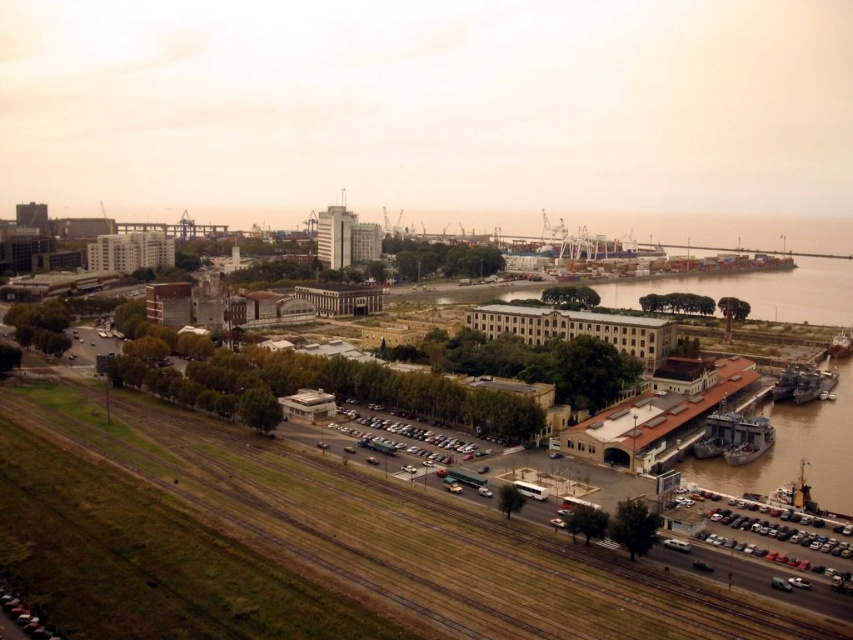
You are a drone operator tasked with capturing aerial footage of the urban waterfront area. You need to ensure that both the brown grassy train track at lower left and the shiny metallic ship at lower right are clearly visible in your shot. Given their sizes, which object should you focus on first to frame the shot appropriately?

The brown grassy train track at lower left is larger in size than the shiny metallic ship at lower right, so you should focus on framing the brown grassy train track at lower left first to ensure it fits within the shot before adjusting for the smaller shiny metallic ship at lower right.

You are a drone operator tasked with capturing aerial footage of the waterfront area. You need to ensure that the shiny metallic ship at lower right is positioned to the right of the brown grassy train track at lower left in the shot. Based on the scene, is this possible?

Yes, because the brown grassy train track at lower left is already positioned to the left of the shiny metallic ship at lower right in the scene.

You are a drone operator tasked with capturing aerial footage of the waterfront area. You need to ensure that the brown grassy train track at lower left and the metallic gray ship at lower right are both visible in the frame. Based on their positions, which object should you prioritize keeping centered to avoid them moving out of the shot first as the drone moves upward?

The metallic gray ship at lower right should be prioritized as it is above the brown grassy train track at lower left. Since the drone is moving upward, the ship will exit the frame first, so keeping it centered will help maintain both in view longer.